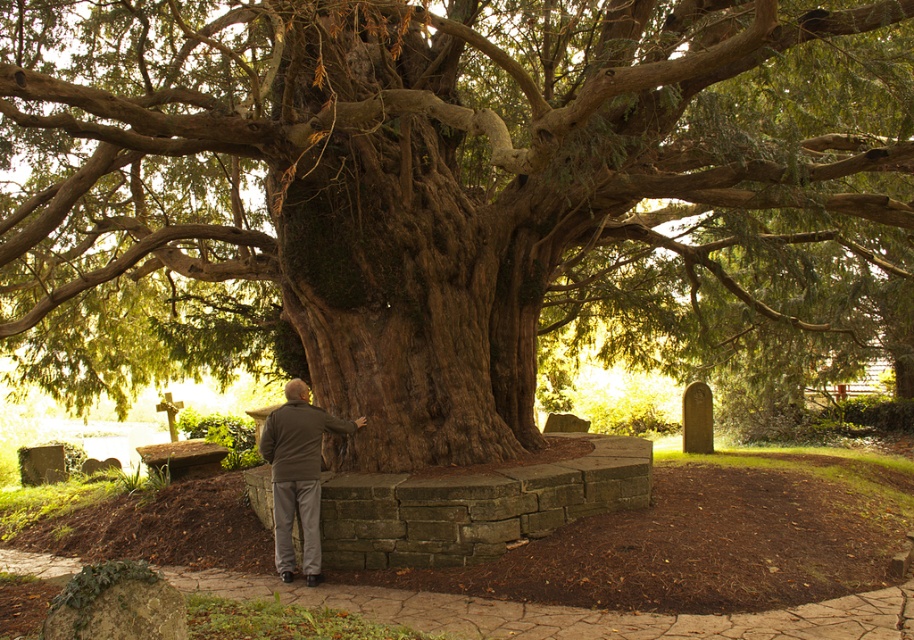
You are a painter standing in front of the ancient tree. You want to paint both the dark brown textured bark at center and the dark gray jacket at center. Based on their sizes, which object should you focus on first to ensure proper perspective?

The dark brown textured bark at center is wider than the dark gray jacket at center, so you should focus on painting the dark brown textured bark at center first to establish its larger size in your painting.

You are a photographer wanting to capture the dark brown textured bark at center and the dark gray jacket at center in the same frame. Based on their positions, which object is closer to the camera?

The dark brown textured bark at center is closer to the camera because it is in front of the dark gray jacket at center.